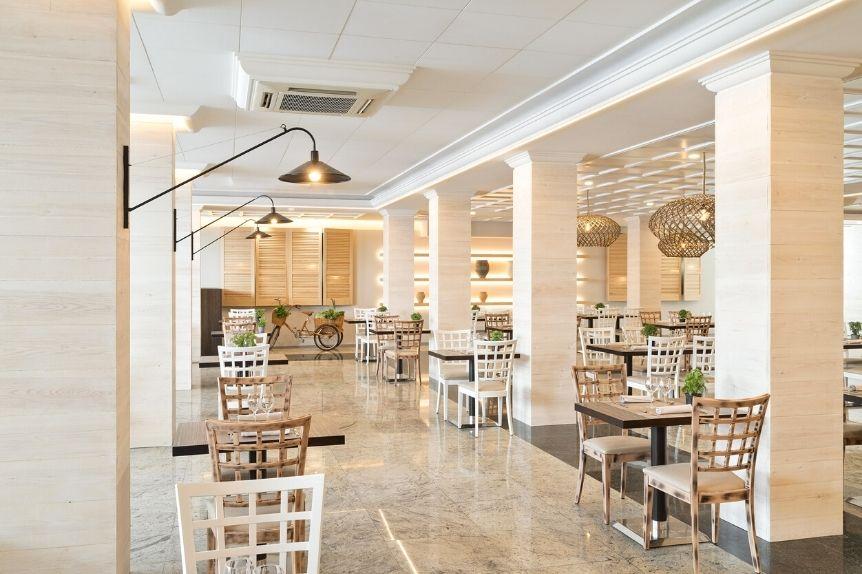
Where is `tan chairs at table`? tan chairs at table is located at coordinates (298, 449), (267, 378), (732, 448), (597, 378), (694, 324), (646, 309), (497, 319), (403, 332), (373, 316).